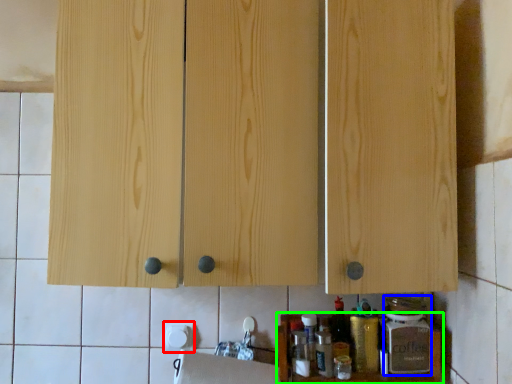
Question: Estimate the real-world distances between objects in this image. Which object is closer to paper towel (highlighted by a red box), bottle (highlighted by a blue box) or cabinet (highlighted by a green box)?

Choices:
 (A) bottle
 (B) cabinet

Answer: (B)